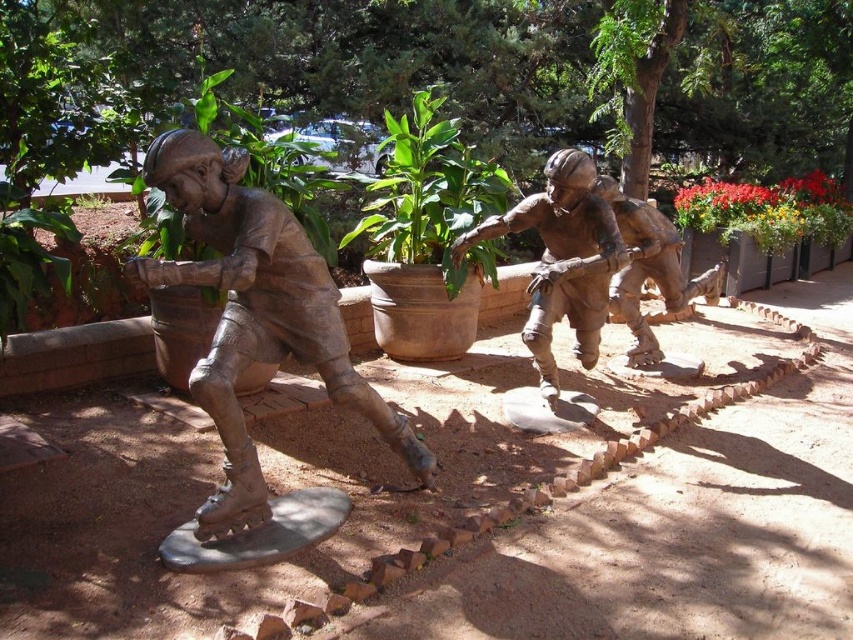
In the scene shown: Who is taller, bronze statue at left or red flower pot at upper right?

With more height is bronze statue at left.

Does point (224, 525) come farther from viewer compared to point (815, 182)?

No, it is in front of (815, 182).

This screenshot has height=640, width=853. Find the location of `bronze statue at left`. bronze statue at left is located at coordinates (256, 314).

Which is below, brushed metal skateboard at center or red flower pot at upper right?

brushed metal skateboard at center is lower down.

Between point (492, 564) and point (682, 196), which one is positioned in front?

Point (492, 564) is more forward.

Does point (576, 625) come closer to viewer compared to point (824, 193)?

Yes, it is in front of point (824, 193).

Identify the location of brushed metal skateboard at center. The height and width of the screenshot is (640, 853). (270, 483).

Is the position of bronze statue at left more distant than that of green leafy plant at center?

No, bronze statue at left is in front of green leafy plant at center.

Which of these two, bronze statue at left or green leafy plant at center, stands shorter?

Standing shorter between the two is green leafy plant at center.

You are a GUI agent. You are given a task and a screenshot of the screen. Output one action in this format:
    pyautogui.click(x=<x>, y=<y>)
    Task: Click on the bronze statue at left
    This screenshot has height=640, width=853.
    Given the screenshot: What is the action you would take?
    pyautogui.click(x=256, y=314)